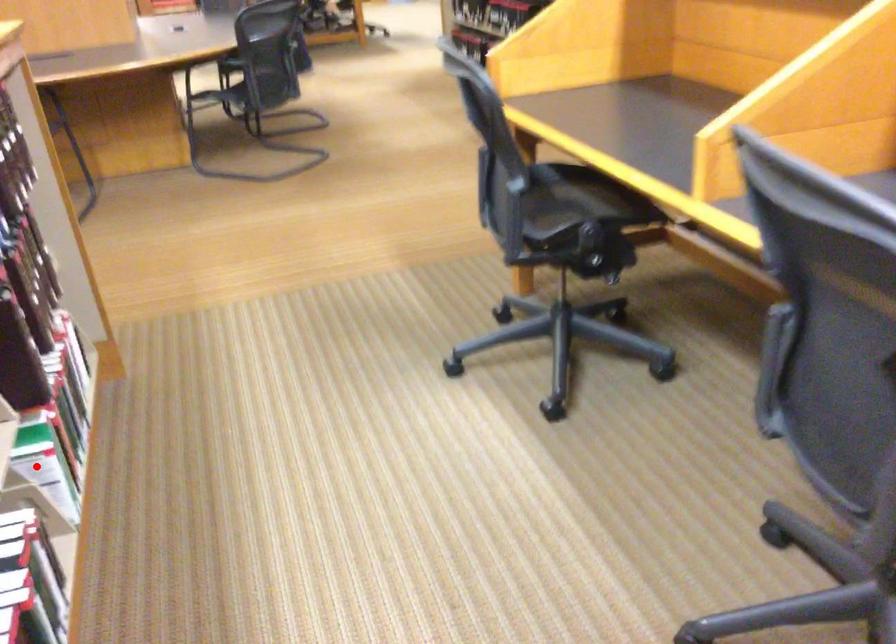
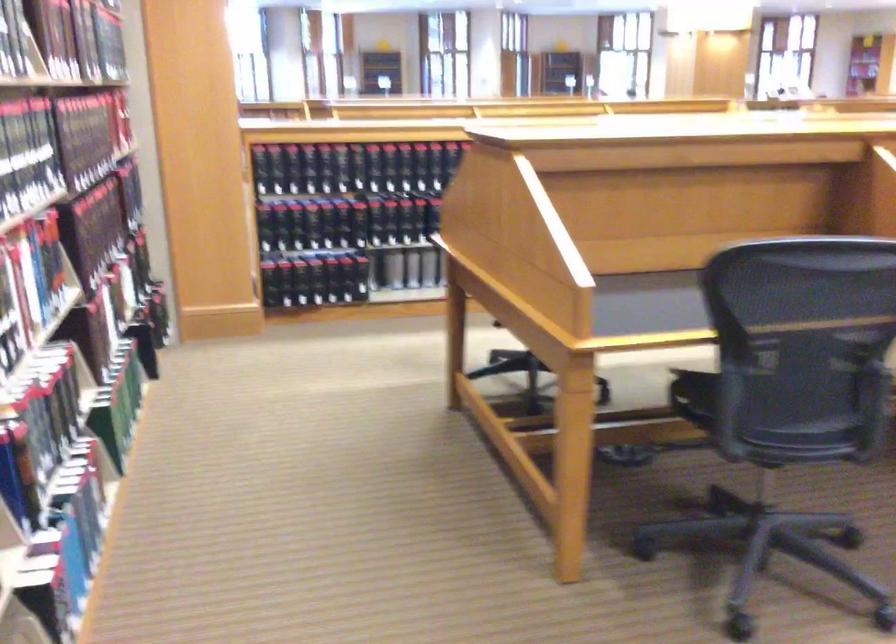
Question: I am providing you with two images of the same scene from different viewpoints. A red point is marked on the first image. Can you still see the location of the red point in image 2?

Choices:
 (A) Yes
 (B) No

Answer: (B)